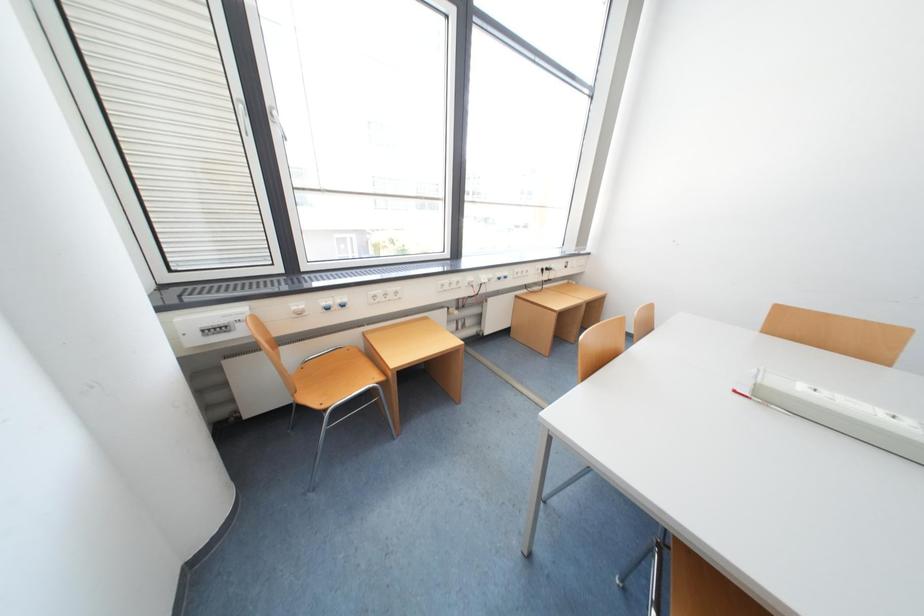
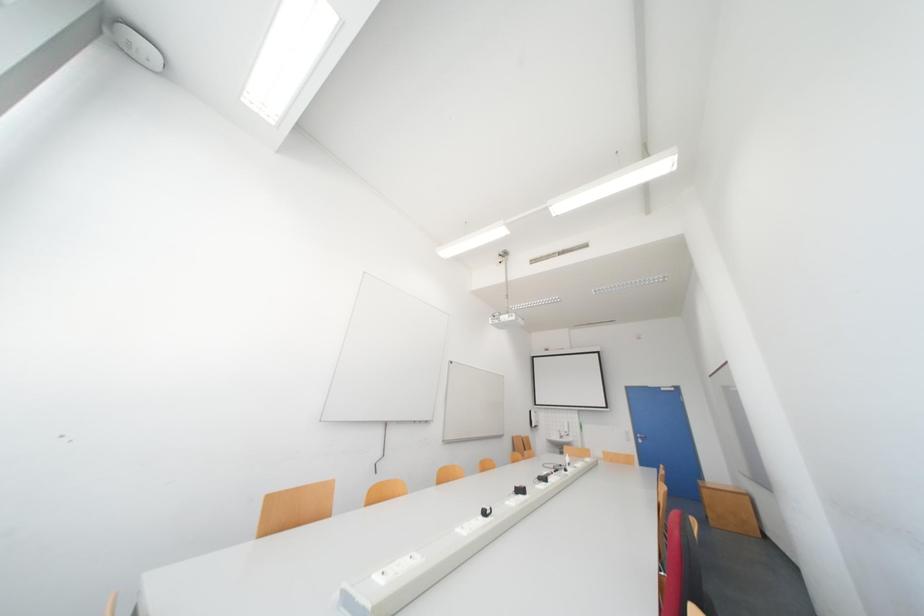
Question: How did the camera likely rotate?

Choices:
 (A) Left
 (B) Right
 (C) Up
 (D) Down

Answer: (B)